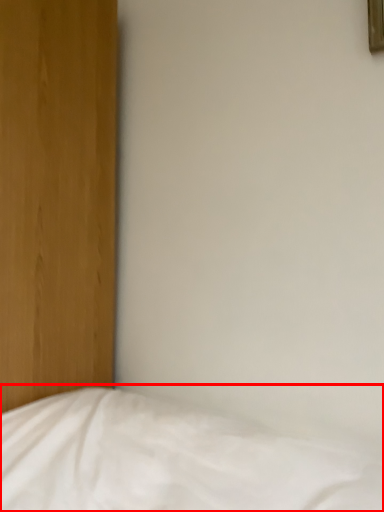
Question: Observing the image, what is the correct spatial positioning of bed (annotated by the red box) in reference to picture frame?

Choices:
 (A) left
 (B) right

Answer: (A)